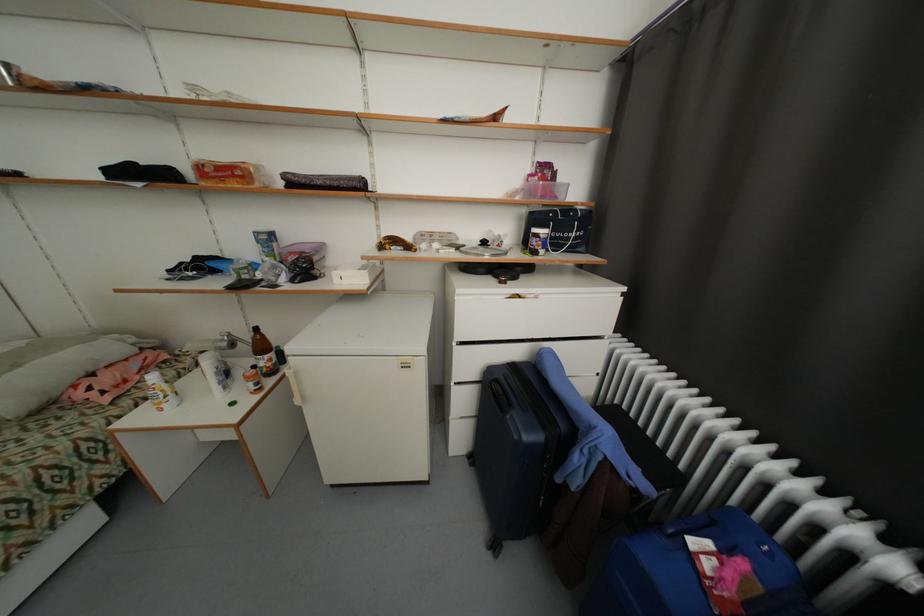
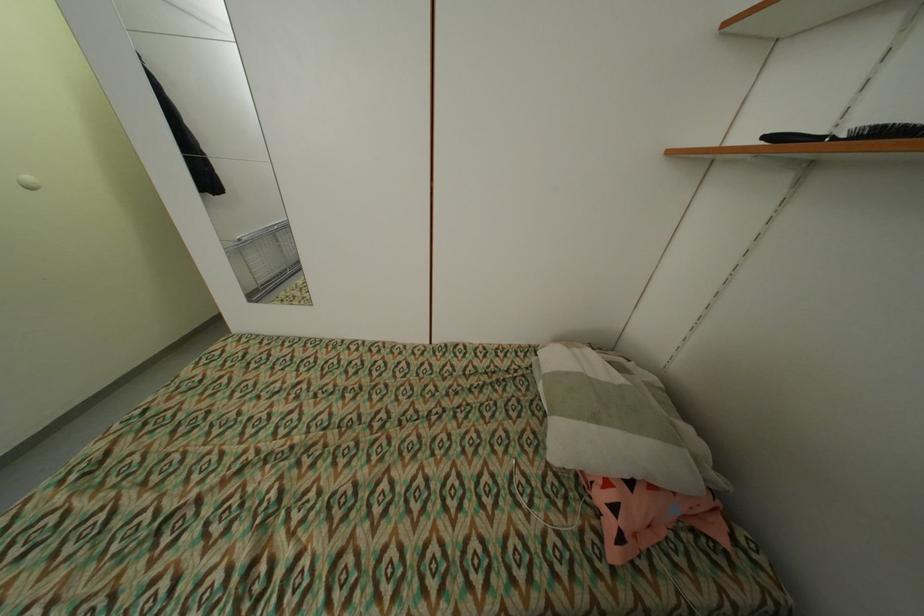
Find the pixel in the second image that matches point (86, 395) in the first image.

(606, 498)